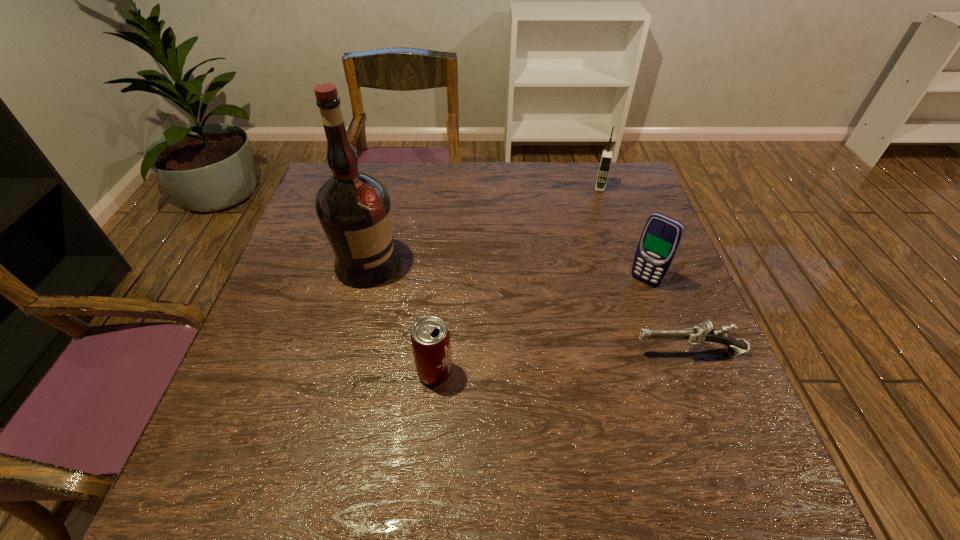
Locate an element on the screen. The image size is (960, 540). free location that satisfies the following two spatial constraints: 1. on the front side of the liquor; 2. on the right side of the nearer cellular telephone is located at coordinates (364, 281).